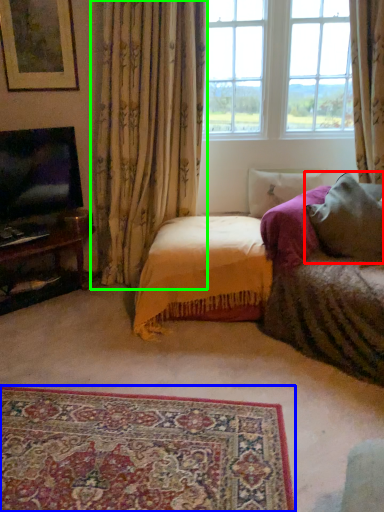
Question: Considering the real-world distances, which object is farthest from pillow (highlighted by a red box)? plain (highlighted by a blue box) or curtain (highlighted by a green box)?

Choices:
 (A) plain
 (B) curtain

Answer: (A)